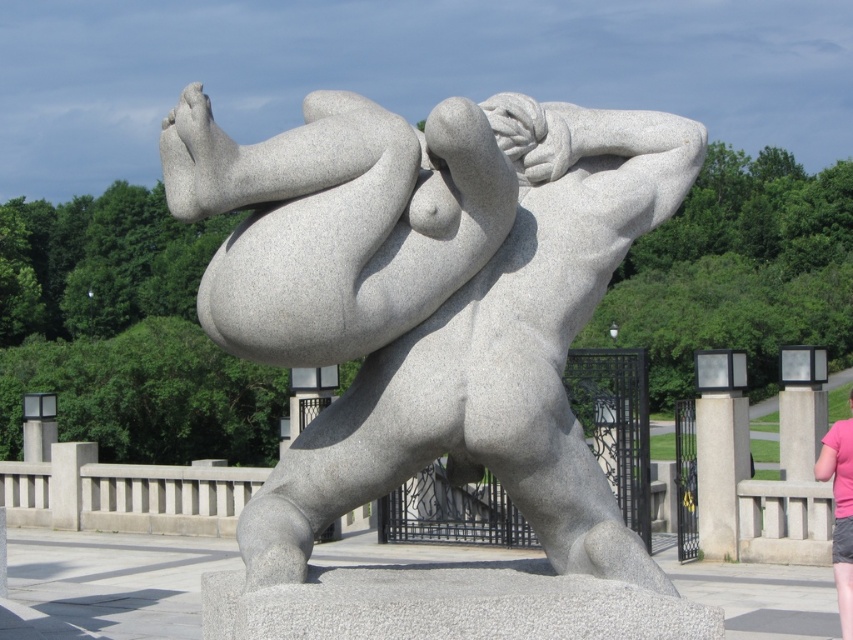
Question: Among these objects, which one is farthest from the camera?

Choices:
 (A) pink fabric at lower right
 (B) granite statue at center

Answer: (A)

Question: Does granite statue at center have a lesser width compared to pink fabric at lower right?

Choices:
 (A) no
 (B) yes

Answer: (B)

Question: Does granite statue at center have a lesser width compared to pink fabric at lower right?

Choices:
 (A) no
 (B) yes

Answer: (B)

Question: Which point appears farthest from the camera in this image?

Choices:
 (A) (846, 634)
 (B) (572, 268)

Answer: (A)

Question: Can you confirm if granite statue at center is wider than pink fabric at lower right?

Choices:
 (A) yes
 (B) no

Answer: (B)